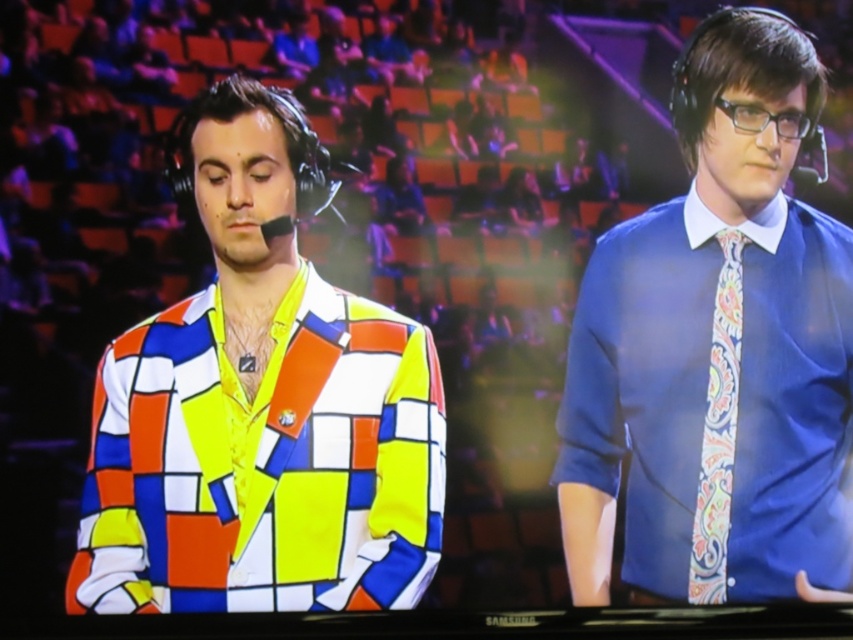
Between blue satin shirt at center and paisley-patterned silk tie at right, which one appears on the right side from the viewer's perspective?

blue satin shirt at center is more to the right.

Which is behind, point (689, 106) or point (700, 548)?

Point (689, 106)

Locate an element on the screen. The width and height of the screenshot is (853, 640). blue satin shirt at center is located at coordinates (717, 349).

Between multicolored fabric shirt at left and paisley-patterned silk tie at right, which one is positioned higher?

multicolored fabric shirt at left

Find the location of a particular element. multicolored fabric shirt at left is located at coordinates (260, 404).

Is point (323, 406) positioned after point (729, 376)?

No, (323, 406) is in front of (729, 376).

This screenshot has width=853, height=640. Find the location of `multicolored fabric shirt at left`. multicolored fabric shirt at left is located at coordinates (260, 404).

Is multicolored fabric shirt at left positioned at the back of blue satin shirt at center?

No, multicolored fabric shirt at left is closer to the viewer.

Can you confirm if multicolored fabric shirt at left is positioned to the left of blue satin shirt at center?

Indeed, multicolored fabric shirt at left is positioned on the left side of blue satin shirt at center.

Find the location of `multicolored fabric shirt at left`. multicolored fabric shirt at left is located at coordinates (260, 404).